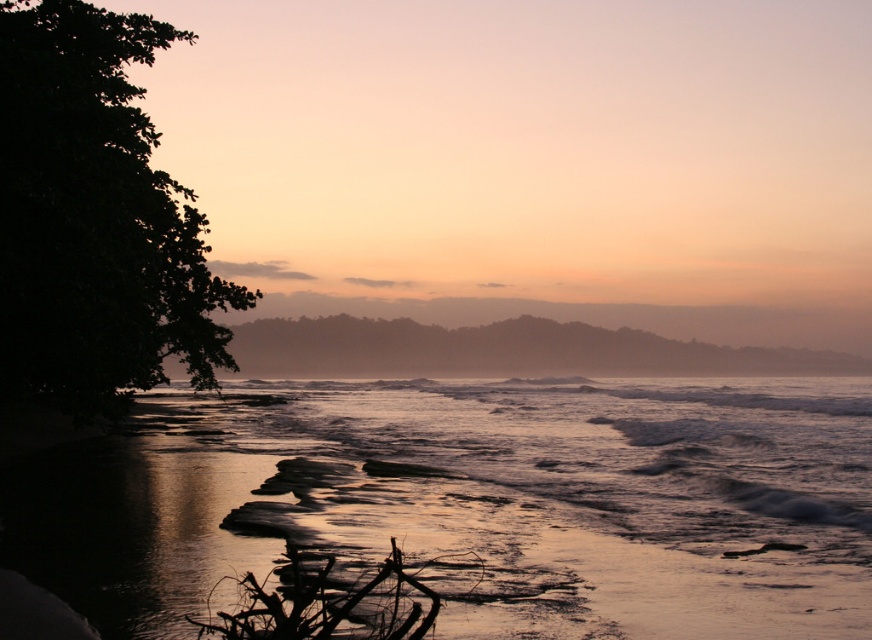
Is shiny wet sand at lower center shorter than dark green leafy tree at left?

Correct, shiny wet sand at lower center is not as tall as dark green leafy tree at left.

Can you confirm if shiny wet sand at lower center is positioned to the right of dark green leafy tree at left?

Yes, shiny wet sand at lower center is to the right of dark green leafy tree at left.

Is point (378, 516) positioned in front of point (159, 298)?

Yes, it is.

Locate an element on the screen. Image resolution: width=872 pixels, height=640 pixels. shiny wet sand at lower center is located at coordinates (559, 496).